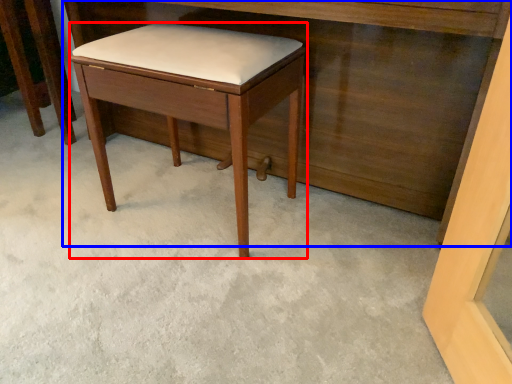
Question: Which object appears farthest to the camera in this image, stool (highlighted by a red box) or vanity (highlighted by a blue box)?

Choices:
 (A) stool
 (B) vanity

Answer: (A)